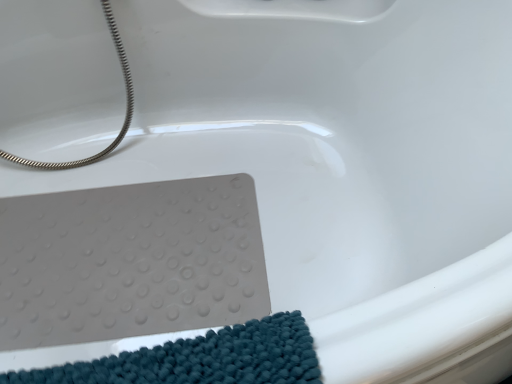
The height and width of the screenshot is (384, 512). What do you see at coordinates (126, 110) in the screenshot?
I see `silver metallic hose at upper left` at bounding box center [126, 110].

Find the location of `silver metallic hose at upper left`. silver metallic hose at upper left is located at coordinates (126, 110).

Measure the distance between silver metallic hose at upper left and camera.

They are 36.42 inches apart.

Find the location of a particular element. silver metallic hose at upper left is located at coordinates (126, 110).